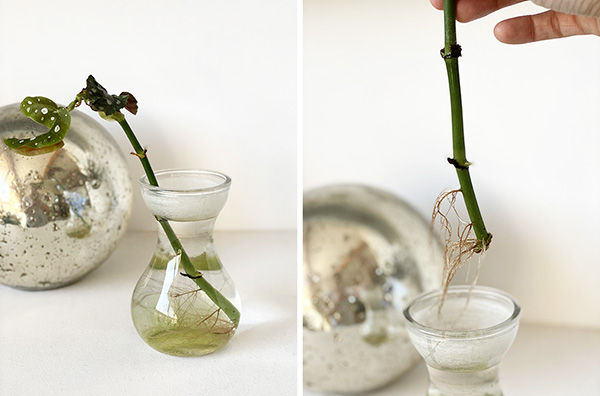
Locate an element on the screen. The height and width of the screenshot is (396, 600). door frame reflection is located at coordinates (61, 159).